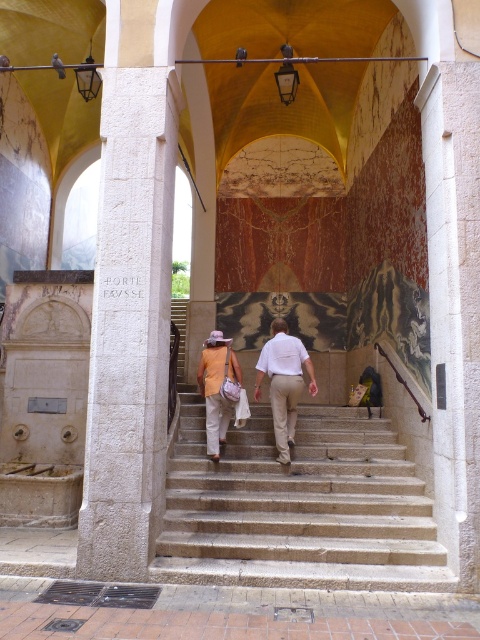
You are an event planner organizing a guided tour in the historical building. You need to ensure that the two guides wearing the white cotton shirt at center and the matte orange shirt at center can be easily distinguished by visitors. Given their sizes, which guide should you assign to stand farther back so they appear the same size to visitors?

The white cotton shirt at center is larger in size than the matte orange shirt at center. To make them appear the same size to visitors, the larger guide wearing the white cotton shirt at center should stand farther back while the smaller matte orange shirt at center stays closer.

You are standing at the bottom of the stone stairs at center and want to climb them while carrying a large box that is as wide as the matte orange shirt at center. Will the box fit through the stairs?

The stone stairs at center are wider than the matte orange shirt at center, so the box will fit through the stairs.